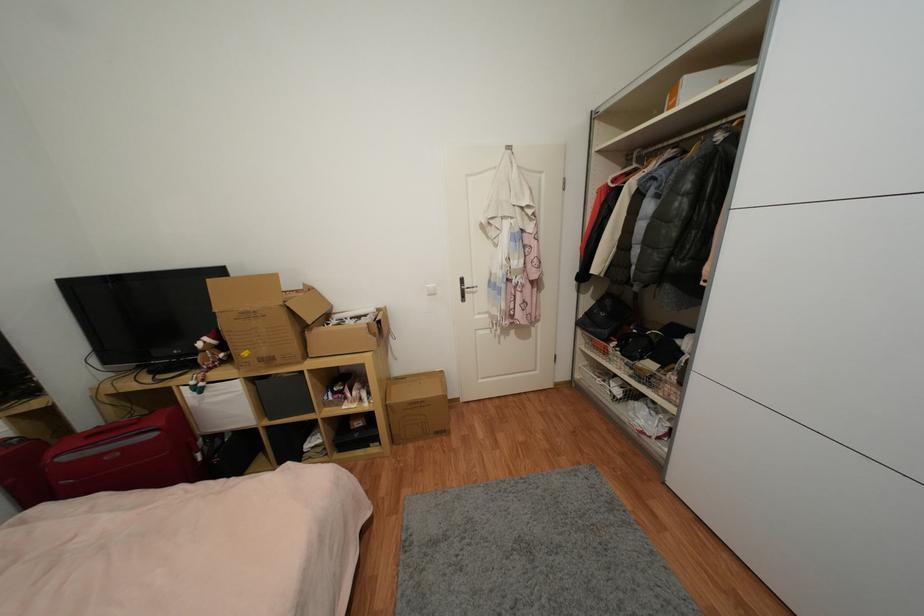
Which object does [263,318] point to?

It refers to a large cardboard box.